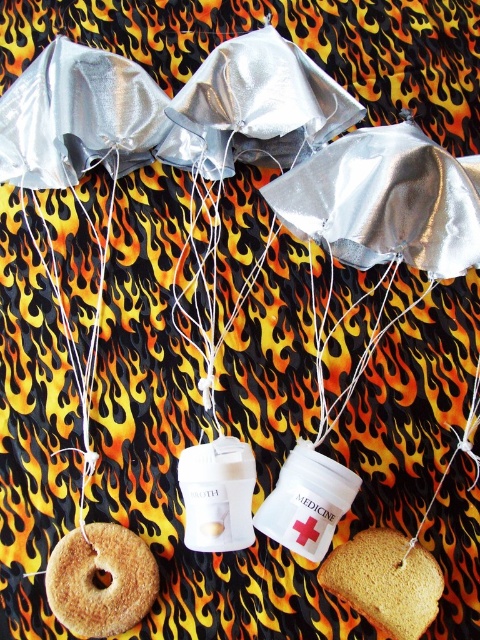
Question: Is golden brown bread at lower right above white string at center?

Choices:
 (A) no
 (B) yes

Answer: (A)

Question: Which point appears farthest from the camera in this image?

Choices:
 (A) (91, 220)
 (B) (356, 564)

Answer: (A)

Question: Considering the relative positions of golden brown bread at lower right and white string at center in the image provided, where is golden brown bread at lower right located with respect to white string at center?

Choices:
 (A) below
 (B) above

Answer: (A)

Question: Based on their relative distances, which object is nearer to the brown crumbly pastry at lower left?

Choices:
 (A) white string at center
 (B) golden brown bread at lower right

Answer: (A)

Question: Considering the relative positions of brown crumbly pastry at lower left and white string at center in the image provided, where is brown crumbly pastry at lower left located with respect to white string at center?

Choices:
 (A) right
 (B) left

Answer: (A)

Question: Which of the following is the farthest from the observer?

Choices:
 (A) (94, 234)
 (B) (107, 548)
 (C) (355, 568)

Answer: (A)